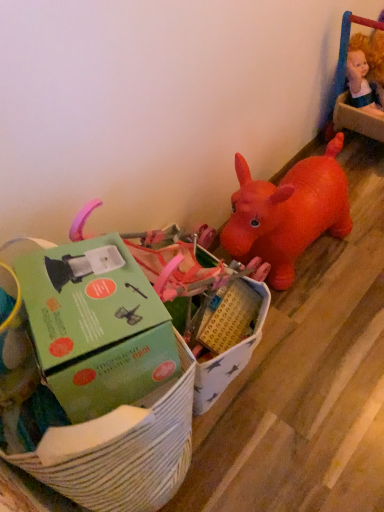
Question: In which direction should I rotate to look at green cardboard box at center, which is the second toy in right-to-left order?

Choices:
 (A) right
 (B) left

Answer: (A)

Question: Does smooth plastic doll at upper right, which is the 2th toy in front-to-back order, have a greater width compared to green cardboard box at lower left?

Choices:
 (A) no
 (B) yes

Answer: (A)

Question: From a real-world perspective, is smooth plastic doll at upper right, which is the second toy in bottom-to-top order, below green cardboard box at lower left?

Choices:
 (A) no
 (B) yes

Answer: (B)

Question: Can you confirm if smooth plastic doll at upper right, which is the second toy in bottom-to-top order, is shorter than green cardboard box at lower left?

Choices:
 (A) yes
 (B) no

Answer: (B)

Question: Does smooth plastic doll at upper right, acting as the 1th toy starting from the right, have a smaller size compared to green cardboard box at lower left?

Choices:
 (A) yes
 (B) no

Answer: (B)

Question: Is smooth plastic doll at upper right, placed as the first toy when sorted from top to bottom, positioned behind green cardboard box at lower left?

Choices:
 (A) yes
 (B) no

Answer: (A)

Question: Considering the relative sizes of smooth plastic doll at upper right, acting as the 1th toy starting from the right, and green cardboard box at lower left in the image provided, is smooth plastic doll at upper right, acting as the 1th toy starting from the right, bigger than green cardboard box at lower left?

Choices:
 (A) no
 (B) yes

Answer: (B)

Question: From the image's perspective, is green cardboard box at center, the 2th toy from the top, on top of smooth plastic doll at upper right, which is the second toy in bottom-to-top order?

Choices:
 (A) yes
 (B) no

Answer: (B)

Question: Does green cardboard box at center, the second toy positioned from the back, come behind smooth plastic doll at upper right, the first toy from the back?

Choices:
 (A) no
 (B) yes

Answer: (A)

Question: Can you confirm if green cardboard box at center, which is the second toy in right-to-left order, is positioned to the left of smooth plastic doll at upper right, placed as the first toy when sorted from top to bottom?

Choices:
 (A) no
 (B) yes

Answer: (B)

Question: Is green cardboard box at center, which ranks as the first toy in bottom-to-top order, turned away from smooth plastic doll at upper right, placed as the first toy when sorted from top to bottom?

Choices:
 (A) yes
 (B) no

Answer: (B)

Question: Does green cardboard box at center, the second toy positioned from the back, have a greater height compared to smooth plastic doll at upper right, which is the second toy in left-to-right order?

Choices:
 (A) yes
 (B) no

Answer: (A)

Question: From a real-world perspective, is green cardboard box at center, the 2th toy from the top, physically below smooth plastic doll at upper right, which is the 2th toy in front-to-back order?

Choices:
 (A) yes
 (B) no

Answer: (A)

Question: Does green cardboard box at center, which is the second toy in right-to-left order, have a lesser height compared to green cardboard box at lower left?

Choices:
 (A) yes
 (B) no

Answer: (B)